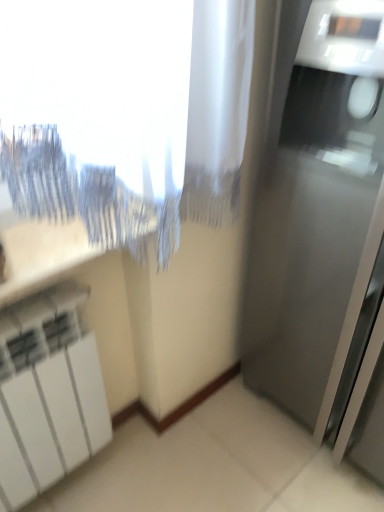
What is the approximate width of satin silver refrigerator at right?

satin silver refrigerator at right is 47.86 centimeters wide.

Image resolution: width=384 pixels, height=512 pixels. In order to click on satin silver refrigerator at right in this screenshot , I will do `click(316, 205)`.

What do you see at coordinates (316, 205) in the screenshot? I see `satin silver refrigerator at right` at bounding box center [316, 205].

Identify the location of satin silver refrigerator at right. This screenshot has width=384, height=512. (316, 205).